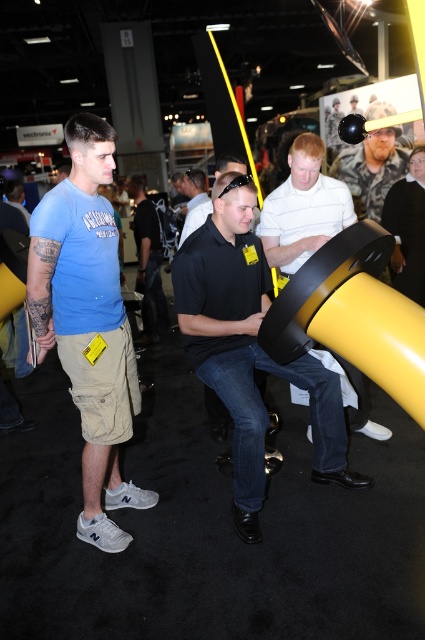
You are a photographer at the exhibition hall. You want to take a photo of the black matte steering wheel at center and the white matte shirt at center so that both are fully visible in the frame. Based on their sizes, which object should you focus on to ensure both are captured without cropping?

The black matte steering wheel at center is much taller than the white matte shirt at center, so you should focus on the black matte steering wheel at center to ensure both are fully visible in the frame.